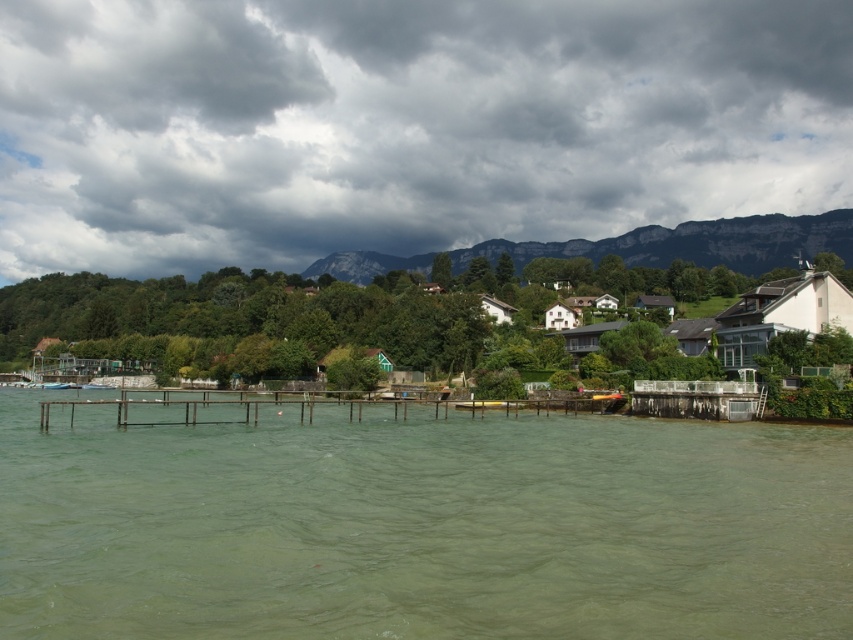
You are standing at the lakeside and want to know how far the point at coordinates (379,58) is from you. Can you determine the distance?

The point at coordinates (379,58) is 1844.47 feet away from you.

Consider the image. You are a hiker who wants to take a photo of the rugged stone mountain at upper center and the brown wooden dock at center. Which object should you position closer to the front of your camera frame to ensure both are in focus?

You should position the brown wooden dock at center closer to the front of your camera frame because the rugged stone mountain at upper center is much taller, so focusing on the closer object will keep both in focus.

You are standing on the lakeside and looking at the green murky water at center and the rugged stone mountain at upper center. Which object occupies a larger area in the scene?

The rugged stone mountain at upper center occupies a larger area in the scene than the green murky water at center.